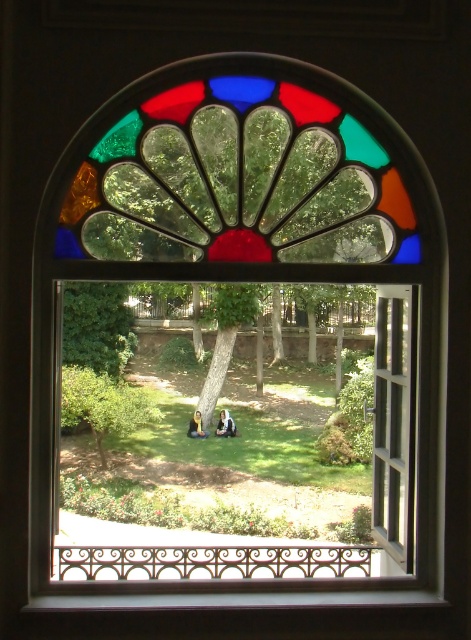
Is green leafy tree at center positioned before white fabric person at center?

Yes, green leafy tree at center is closer to the viewer.

The width and height of the screenshot is (471, 640). What are the coordinates of `green leafy tree at center` in the screenshot? It's located at (103, 404).

Is point (140, 417) closer to camera compared to point (194, 426)?

Yes, it is.

Can you confirm if green leafy tree at center is wider than light brown hair at center?

Indeed, green leafy tree at center has a greater width compared to light brown hair at center.

Between point (131, 404) and point (194, 413), which one is positioned in front?

Point (131, 404)

Find the location of a particular element. The width and height of the screenshot is (471, 640). green leafy tree at center is located at coordinates (103, 404).

Does smooth brown tree trunk at center lie behind light brown hair at center?

Yes, smooth brown tree trunk at center is behind light brown hair at center.

Between smooth brown tree trunk at center and light brown hair at center, which one has less height?

With less height is smooth brown tree trunk at center.

Locate an element on the screen. This screenshot has width=471, height=640. smooth brown tree trunk at center is located at coordinates (226, 337).

In order to click on smooth brown tree trunk at center in this screenshot , I will do `click(226, 337)`.